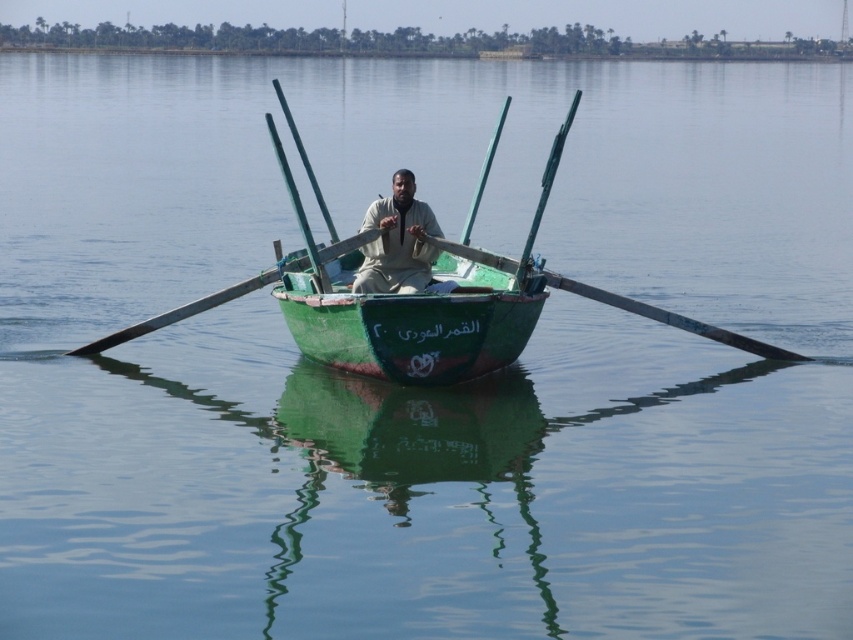
You are standing on the dock and see the green wood paddle at center and the green wooden paddle at center in the boat. Which paddle is closer to you?

Both paddles are the same paddle. The names are just different ways to refer to the same object. There is no difference in their distance from you.

You are a tourist on a boat and need to choose between the green wood paddle at center and the green wooden paddle at center. Which paddle is shorter in height?

The green wood paddle at center is shorter in height compared to the green wooden paddle at center.

You are standing on the dock and see the green matte canoe at center and the light brown fabric shirt at center in the water. Which object is located to the right of the other?

The green matte canoe at center is positioned on the right side of light brown fabric shirt at center, so the green matte canoe at center is to the right of the light brown fabric shirt at center.